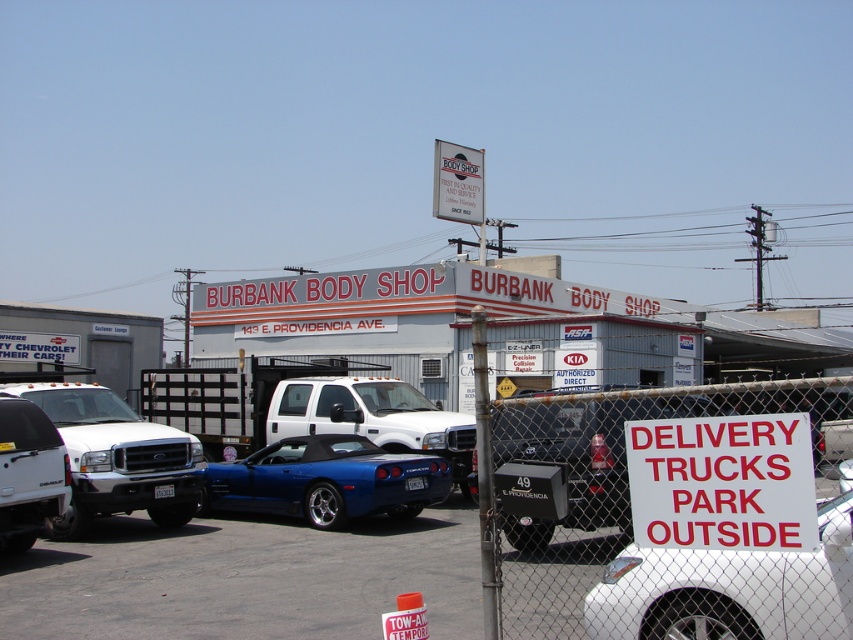
Measure the distance between point (753, 552) and camera.

Point (753, 552) and camera are 4.09 meters apart.

Is white glossy car at lower right further to camera compared to glossy blue convertible at center?

No, it is not.

This screenshot has width=853, height=640. Identify the location of white glossy car at lower right. (729, 589).

Which is in front, point (604, 593) or point (3, 397)?

Point (604, 593) is more forward.

Does white glossy car at lower right appear on the right side of matte white truck at left?

Correct, you'll find white glossy car at lower right to the right of matte white truck at left.

Is point (625, 636) positioned after point (22, 531)?

No, (625, 636) is in front of (22, 531).

Find the location of a particular element. white glossy car at lower right is located at coordinates (729, 589).

Is point (186, 632) more distant than point (229, 481)?

No, (186, 632) is in front of (229, 481).

Does point (578, 608) come farther from viewer compared to point (340, 436)?

No.

The image size is (853, 640). What are the coordinates of `white glossy truck at left` in the screenshot? It's located at (247, 579).